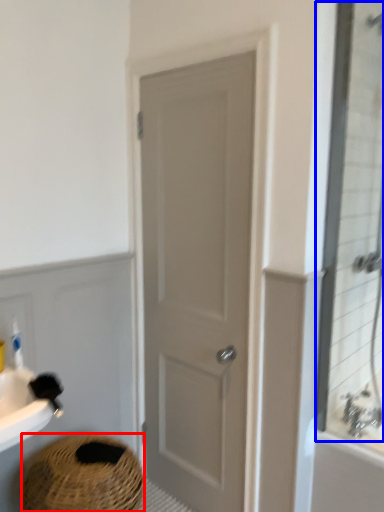
Question: Which object is further to the camera taking this photo, basket (highlighted by a red box) or mirror (highlighted by a blue box)?

Choices:
 (A) basket
 (B) mirror

Answer: (A)